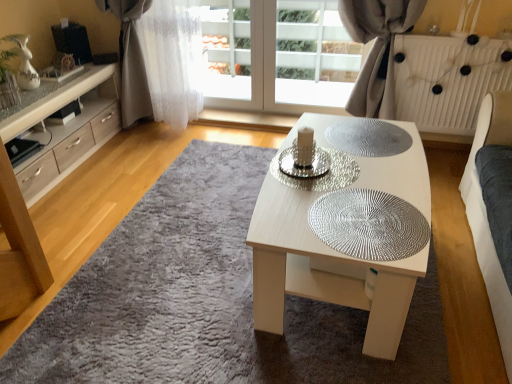
This screenshot has width=512, height=384. I want to click on free spot above silver textured glass plate at center, the 2th glass plate in the front-to-back sequence (from a real-world perspective), so click(326, 166).